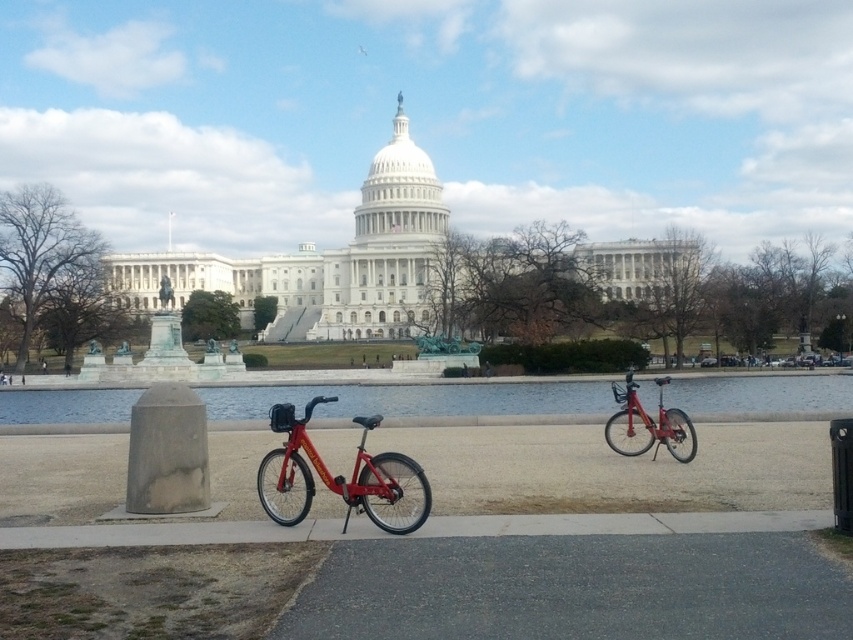
Does clear water at center have a greater height compared to metallic red bicycle at right?

Incorrect, clear water at center's height is not larger of metallic red bicycle at right's.

Who is shorter, clear water at center or metallic red bicycle at right?

With less height is clear water at center.

Is point (302, 400) positioned in front of point (631, 374)?

No, it is not.

The height and width of the screenshot is (640, 853). I want to click on clear water at center, so click(x=415, y=400).

From the picture: Does clear water at center have a lesser width compared to metallic red bicycle at center?

In fact, clear water at center might be wider than metallic red bicycle at center.

Does point (225, 387) come farther from viewer compared to point (296, 458)?

Yes, point (225, 387) is behind point (296, 458).

This screenshot has width=853, height=640. I want to click on clear water at center, so click(415, 400).

The image size is (853, 640). Describe the element at coordinates (340, 476) in the screenshot. I see `metallic red bicycle at center` at that location.

Can you confirm if metallic red bicycle at center is positioned to the right of metallic red bicycle at right?

In fact, metallic red bicycle at center is to the left of metallic red bicycle at right.

Is point (357, 420) in front of point (648, 417)?

That is True.

What are the coordinates of `metallic red bicycle at center` in the screenshot? It's located at (340, 476).